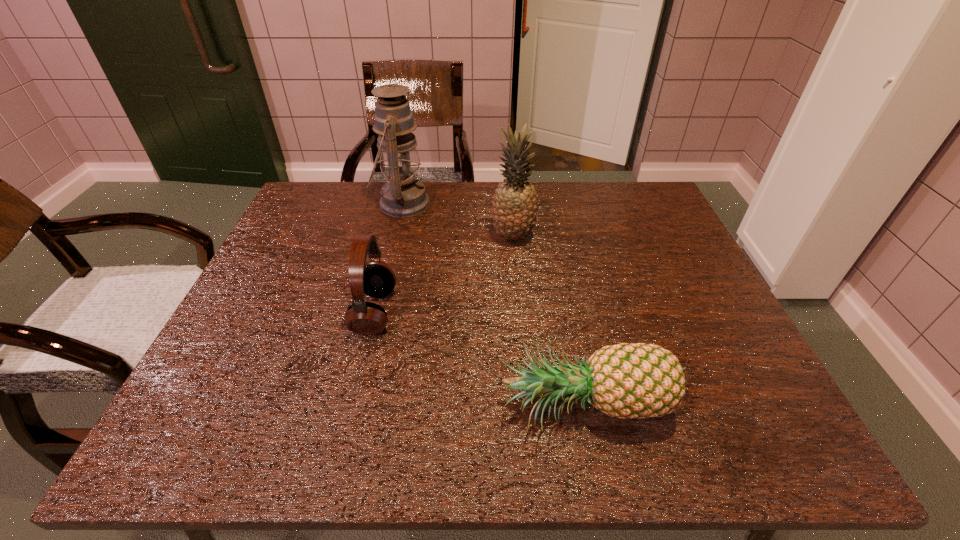
Locate an element on the screen. Image resolution: width=960 pixels, height=540 pixels. vacant point located between the oil lamp and the headset is located at coordinates (389, 258).

I want to click on free space between the shorter pineapple and the oil lamp, so click(494, 306).

The image size is (960, 540). What are the coordinates of `free spot between the oil lamp and the third tallest object` in the screenshot? It's located at (389, 258).

You are a GUI agent. You are given a task and a screenshot of the screen. Output one action in this format:
    pyautogui.click(x=<x>, y=<y>)
    Task: Click on the free space between the oil lamp and the second shortest object
    
    Given the screenshot: What is the action you would take?
    click(x=389, y=258)

This screenshot has height=540, width=960. I want to click on empty space between the oil lamp and the third tallest object, so click(389, 258).

Identify the location of free space between the taller pineapple and the third tallest object. Image resolution: width=960 pixels, height=540 pixels. (444, 274).

The width and height of the screenshot is (960, 540). I want to click on unoccupied position between the farther pineapple and the shortest object, so pos(550,322).

The image size is (960, 540). What are the coordinates of `vacant area that lies between the taller pineapple and the second nearest object` in the screenshot? It's located at (444, 274).

Identify the location of vacant area between the taller pineapple and the nearer pineapple. [550, 322].

Where is `empty location between the shortest object and the oil lamp`? empty location between the shortest object and the oil lamp is located at coordinates (494, 306).